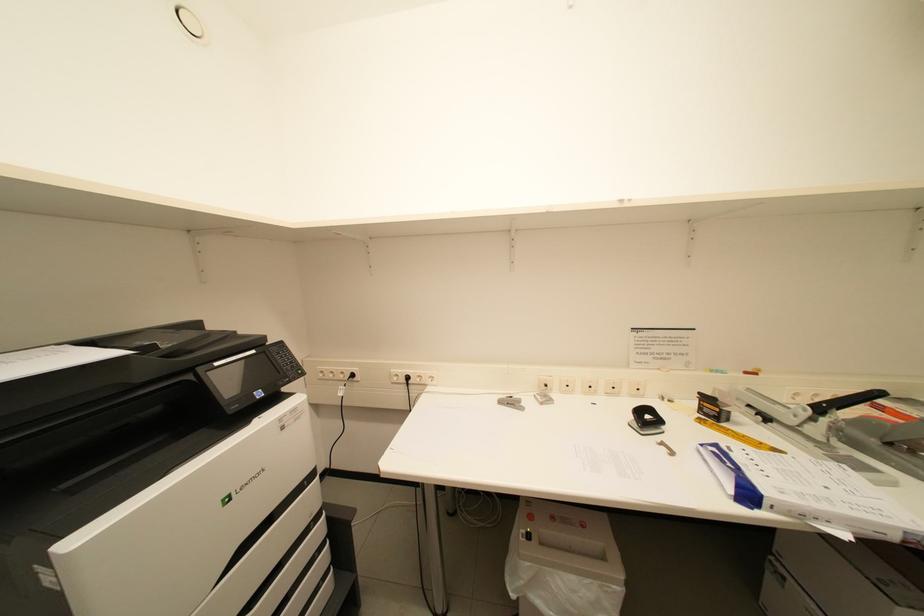
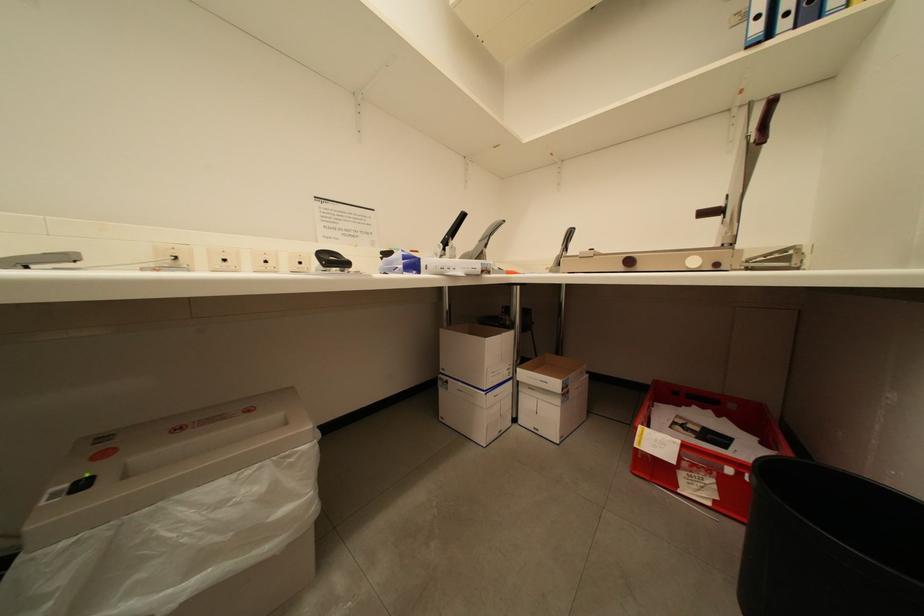
Question: The camera is either moving clockwise (left) or counter-clockwise (right) around the object. The first image is from the beginning of the video and the second image is from the end. Is the camera moving left or right when shooting the video?

Choices:
 (A) Left
 (B) Right

Answer: (A)